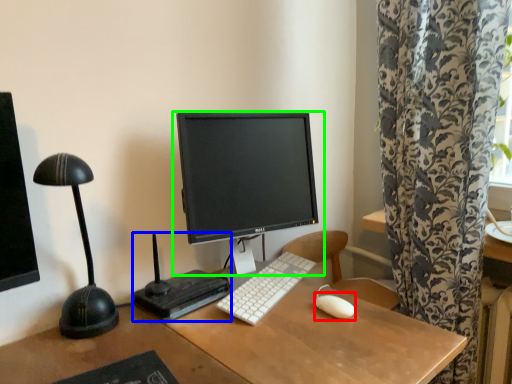
Question: Which is farther away from mouse (highlighted by a red box)? equipment (highlighted by a blue box) or computer monitor (highlighted by a green box)?

Choices:
 (A) equipment
 (B) computer monitor

Answer: (B)